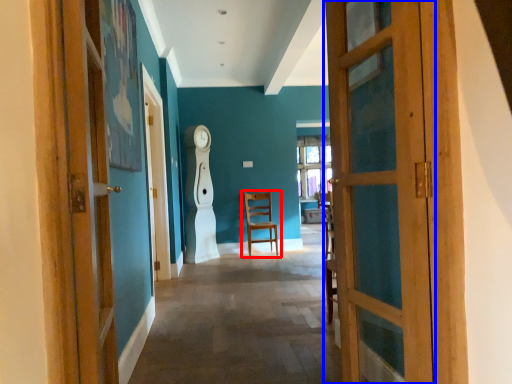
Question: Which object appears farthest to the camera in this image, chair (highlighted by a red box) or door (highlighted by a blue box)?

Choices:
 (A) chair
 (B) door

Answer: (A)